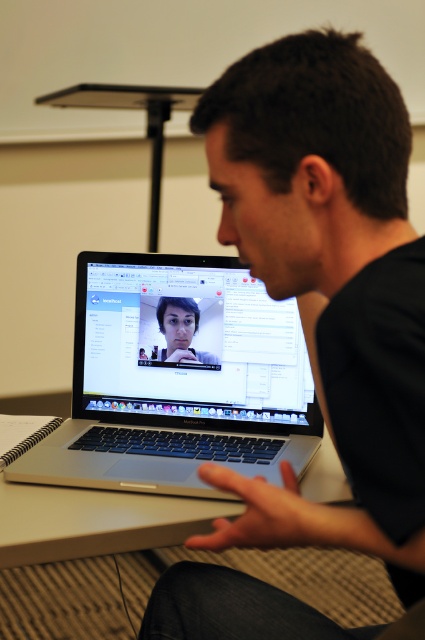
Question: Considering the real-world distances, which object is closest to the black matte laptop at center?

Choices:
 (A) silver metallic laptop at center
 (B) matte black face at center
 (C) silver metallic table at center

Answer: (C)

Question: Can you confirm if silver metallic laptop at center is bigger than silver metallic table at center?

Choices:
 (A) no
 (B) yes

Answer: (B)

Question: Which object is farther from the camera taking this photo?

Choices:
 (A) black matte laptop at center
 (B) matte black face at center
 (C) silver metallic table at center

Answer: (B)

Question: Is black matte laptop at center positioned before silver metallic laptop at center?

Choices:
 (A) no
 (B) yes

Answer: (B)

Question: Considering the real-world distances, which object is farthest from the silver metallic laptop at center?

Choices:
 (A) silver metallic table at center
 (B) matte black face at center
 (C) black matte laptop at center

Answer: (C)

Question: Is silver metallic laptop at center bigger than matte black face at center?

Choices:
 (A) no
 (B) yes

Answer: (B)